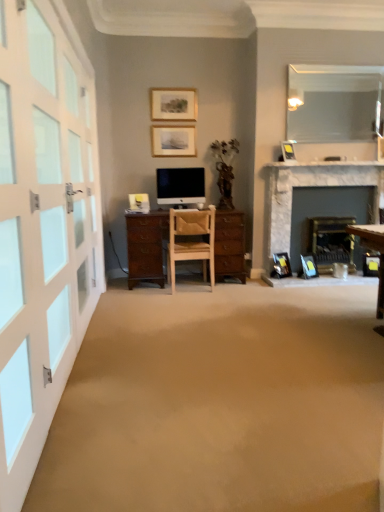
Question: Is matte black picture frame at lower right, which is the 2th picture frame from bottom to top, positioned beyond the bounds of matte black picture frame at upper center, arranged as the second picture frame when viewed from the right?

Choices:
 (A) no
 (B) yes

Answer: (B)

Question: From the image's perspective, is matte black picture frame at lower right, which is the 3th picture frame in right-to-left order, located beneath matte black picture frame at upper center, which is the third picture frame in top-to-bottom order?

Choices:
 (A) yes
 (B) no

Answer: (A)

Question: Is matte black picture frame at lower right, which is the 2th picture frame from bottom to top, positioned behind matte black picture frame at upper center, which is the third picture frame in top-to-bottom order?

Choices:
 (A) yes
 (B) no

Answer: (A)

Question: Can you confirm if matte black picture frame at lower right, the 3th picture frame viewed from the left, is bigger than matte black picture frame at upper center, which is the third picture frame in top-to-bottom order?

Choices:
 (A) yes
 (B) no

Answer: (A)

Question: Considering the relative sizes of matte black picture frame at lower right, the 3th picture frame viewed from the left, and matte black picture frame at upper center, placed as the 3th picture frame when sorted from bottom to top, in the image provided, is matte black picture frame at lower right, the 3th picture frame viewed from the left, wider than matte black picture frame at upper center, placed as the 3th picture frame when sorted from bottom to top,?

Choices:
 (A) no
 (B) yes

Answer: (B)

Question: Is matte black picture frame at lower right, which is the 3th picture frame in right-to-left order, smaller than matte black picture frame at upper center, arranged as the second picture frame when viewed from the right?

Choices:
 (A) yes
 (B) no

Answer: (B)

Question: Does matte wooden picture frame at upper center, the second picture frame from the top, contain light brown wooden chair at center?

Choices:
 (A) no
 (B) yes

Answer: (A)

Question: Is matte wooden picture frame at upper center, which ranks as the 4th picture frame in right-to-left order, facing towards light brown wooden chair at center?

Choices:
 (A) no
 (B) yes

Answer: (A)

Question: Is matte wooden picture frame at upper center, acting as the 2th picture frame starting from the left, not within light brown wooden chair at center?

Choices:
 (A) yes
 (B) no

Answer: (A)

Question: Is matte wooden picture frame at upper center, acting as the 2th picture frame starting from the left, oriented away from light brown wooden chair at center?

Choices:
 (A) yes
 (B) no

Answer: (B)

Question: Can you confirm if matte wooden picture frame at upper center, which ranks as the 4th picture frame in right-to-left order, is shorter than light brown wooden chair at center?

Choices:
 (A) yes
 (B) no

Answer: (A)

Question: Is matte wooden picture frame at upper center, which ranks as the 4th picture frame in right-to-left order, directly adjacent to light brown wooden chair at center?

Choices:
 (A) yes
 (B) no

Answer: (B)

Question: Is blue plastic picture frame at lower right, which is the 5th picture frame from top to bottom, located within matte wooden picture frame at upper center, which is counted as the 5th picture frame, starting from the bottom?

Choices:
 (A) yes
 (B) no

Answer: (B)